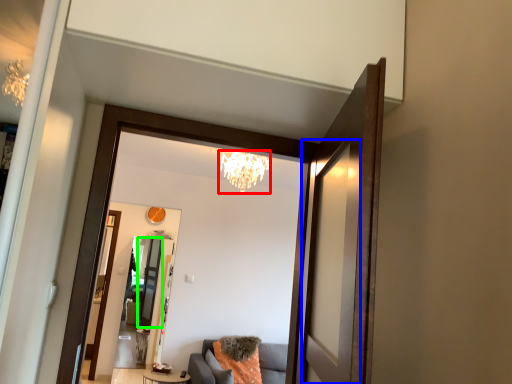
Question: Based on their relative distances, which object is farther from light fixture (highlighted by a red box)? Choose from screen door (highlighted by a blue box) and screen door (highlighted by a green box).

Choices:
 (A) screen door
 (B) screen door

Answer: (A)